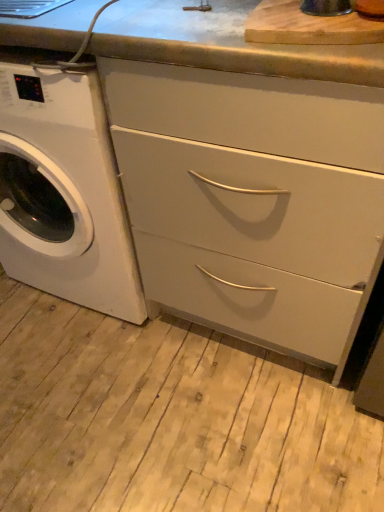
You are a GUI agent. You are given a task and a screenshot of the screen. Output one action in this format:
    pyautogui.click(x=<x>, y=<y>)
    Task: Click on the white glossy washing machine at left
    Image resolution: width=384 pixels, height=512 pixels.
    Given the screenshot: What is the action you would take?
    pyautogui.click(x=63, y=193)

This screenshot has height=512, width=384. What do you see at coordinates (63, 193) in the screenshot? I see `white glossy washing machine at left` at bounding box center [63, 193].

You are a GUI agent. You are given a task and a screenshot of the screen. Output one action in this format:
    pyautogui.click(x=<x>, y=<y>)
    Task: Click on the matte white drawers at center
    
    Given the screenshot: What is the action you would take?
    pyautogui.click(x=251, y=198)

Would you say white glossy washing machine at left contains wooden cutting board at upper center?

Definitely not — wooden cutting board at upper center is not inside white glossy washing machine at left.

From a real-world perspective, is white glossy washing machine at left over wooden cutting board at upper center?

No, from a real-world perspective, white glossy washing machine at left is not above wooden cutting board at upper center.

Consider the image. How different are the orientations of white glossy washing machine at left and wooden cutting board at upper center in degrees?

The facing directions of white glossy washing machine at left and wooden cutting board at upper center are 44 degrees apart.

Identify the location of cutting board above the white glossy washing machine at left (from the image's perspective). (309, 26).

Does wooden cutting board at upper center lie behind white glossy washing machine at left?

No, it is in front of white glossy washing machine at left.

Is wooden cutting board at upper center placed right next to white glossy washing machine at left?

No, wooden cutting board at upper center is not next to white glossy washing machine at left.

Can you confirm if wooden cutting board at upper center is taller than white glossy washing machine at left?

No, wooden cutting board at upper center is not taller than white glossy washing machine at left.

The height and width of the screenshot is (512, 384). In the image, there is a white glossy washing machine at left. Find the location of `cutting board above it (from the image's perspective)`. cutting board above it (from the image's perspective) is located at coordinates (309, 26).

Can you tell me how much wooden cutting board at upper center and matte white drawers at center differ in facing direction?

There is a 44.7-degree angle between the facing directions of wooden cutting board at upper center and matte white drawers at center.

From the image's perspective, which one is positioned lower, wooden cutting board at upper center or matte white drawers at center?

matte white drawers at center is shown below in the image.

Consider the image. From a real-world perspective, is wooden cutting board at upper center located beneath matte white drawers at center?

No, from a real-world perspective, wooden cutting board at upper center is not below matte white drawers at center.

Which object is wider, wooden cutting board at upper center or matte white drawers at center?

With larger width is matte white drawers at center.

Considering the positions of points (73, 83) and (227, 271), is point (73, 83) farther from camera compared to point (227, 271)?

No.

From the image's perspective, is white glossy washing machine at left below matte white drawers at center?

No, from the image's perspective, white glossy washing machine at left is not beneath matte white drawers at center.

Is white glossy washing machine at left oriented away from matte white drawers at center?

No, white glossy washing machine at left is not facing the opposite direction of matte white drawers at center.

Consider the image. From a real-world perspective, between white glossy washing machine at left and matte white drawers at center, who is vertically higher?

white glossy washing machine at left, from a real-world perspective.

From the picture: Is matte white drawers at center oriented towards white glossy washing machine at left?

No.

From a real-world perspective, which is physically above, matte white drawers at center or white glossy washing machine at left?

From a 3D spatial view, white glossy washing machine at left is above.

Which is less distant, (173, 91) or (27, 259)?

The point (173, 91) is closer.

What's the angular difference between matte white drawers at center and white glossy washing machine at left's facing directions?

The facing directions of matte white drawers at center and white glossy washing machine at left are 0.679 degrees apart.

Is matte white drawers at center next to wooden cutting board at upper center and touching it?

No, matte white drawers at center is not touching wooden cutting board at upper center.

Consider the image. From a real-world perspective, is matte white drawers at center physically above wooden cutting board at upper center?

Actually, matte white drawers at center is physically below wooden cutting board at upper center in the real world.

Is matte white drawers at center situated inside wooden cutting board at upper center or outside?

matte white drawers at center is not enclosed by wooden cutting board at upper center.

Is matte white drawers at center thinner than wooden cutting board at upper center?

In fact, matte white drawers at center might be wider than wooden cutting board at upper center.

Where is `cutting board located in front of the white glossy washing machine at left`? The height and width of the screenshot is (512, 384). cutting board located in front of the white glossy washing machine at left is located at coordinates (309, 26).

What are the coordinates of `washing machine that appears behind the wooden cutting board at upper center` in the screenshot? It's located at (63, 193).

Considering their positions, is matte white drawers at center positioned further to wooden cutting board at upper center than white glossy washing machine at left?

Among the two, white glossy washing machine at left is located further to wooden cutting board at upper center.

Considering their positions, is wooden cutting board at upper center positioned closer to white glossy washing machine at left than matte white drawers at center?

matte white drawers at center is positioned closer to the anchor white glossy washing machine at left.

Based on their spatial positions, is matte white drawers at center or wooden cutting board at upper center further from white glossy washing machine at left?

wooden cutting board at upper center is positioned further to the anchor white glossy washing machine at left.

When comparing their distances from matte white drawers at center, does wooden cutting board at upper center or white glossy washing machine at left seem further?

wooden cutting board at upper center is further to matte white drawers at center.

From the image, which object appears to be farther from wooden cutting board at upper center, white glossy washing machine at left or matte white drawers at center?

The object further to wooden cutting board at upper center is white glossy washing machine at left.

From the image, which object appears to be farther from matte white drawers at center, white glossy washing machine at left or wooden cutting board at upper center?

Among the two, wooden cutting board at upper center is located further to matte white drawers at center.

Locate an element on the screen. Image resolution: width=384 pixels, height=512 pixels. cutting board situated between white glossy washing machine at left and matte white drawers at center from left to right is located at coordinates (309, 26).